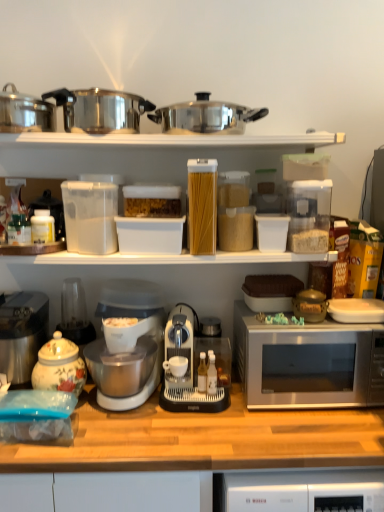
Question: In the image, is white plastic containers at upper center positioned in front of or behind wooden at lower center?

Choices:
 (A) front
 (B) behind

Answer: (B)

Question: Would you say white plastic containers at upper center is to the left or to the right of wooden at lower center in the picture?

Choices:
 (A) right
 (B) left

Answer: (B)

Question: Which object is the farthest from the white plastic containers at upper center?

Choices:
 (A) porcelain floral tea pot at left
 (B) satin silver microwave at right
 (C) wooden at lower center
 (D) white plastic mixer at center
 (E) shiny metallic crock pot at upper center, the first crock pot positioned from the left

Answer: (C)

Question: Which is farther from the shiny metallic crock pot at upper center, the second crock pot positioned from the right?

Choices:
 (A) polished stainless steel pot at upper center, the 2th crock pot when ordered from left to right
 (B) stainless steel coffee maker at left
 (C) translucent plastic container at center
 (D) white plastic mixer at center
 (E) wooden at lower center

Answer: (E)